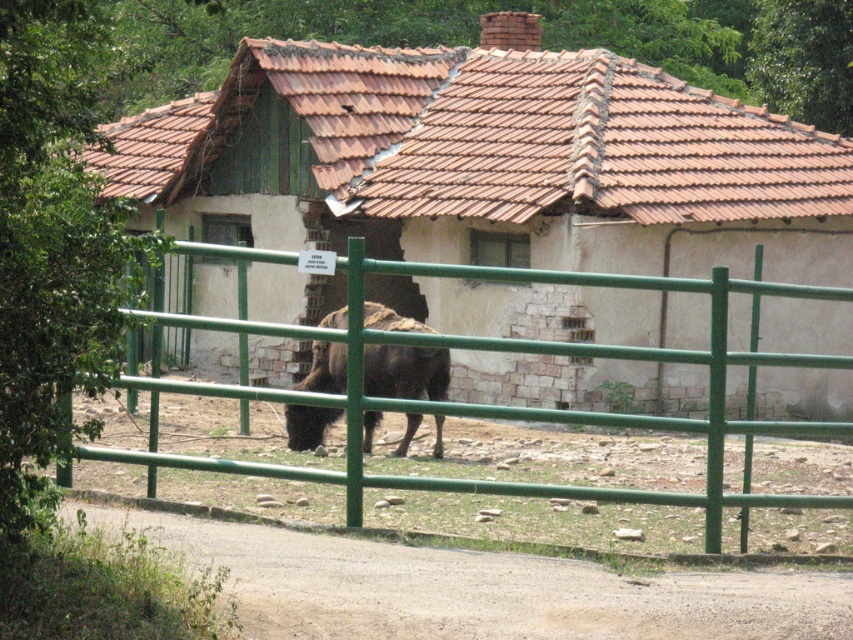
You are a visitor approaching the green metal fence at center and the brown furry yak at center in the scene. From your perspective, which object appears closer to you?

The green metal fence at center appears closer because it is positioned over the brown furry yak at center, blocking part of its view.

You are standing at the origin point in the image. You want to walk towards the white stone hut at center. Which direction should you move in?

To reach the white stone hut at center, you should move towards the point with coordinates 0.252 on the x axis and 0.574 on the y axis.

You are standing in front of the rustic building and want to get a better view of the brown furry yak at center. Since the green metal fence at center is blocking your view, can you move to the left or right to see around it?

The green metal fence at center is closer to the viewer than the brown furry yak at center, so moving to the left or right might allow you to see around the green metal fence at center and get a better view of the brown furry yak at center.